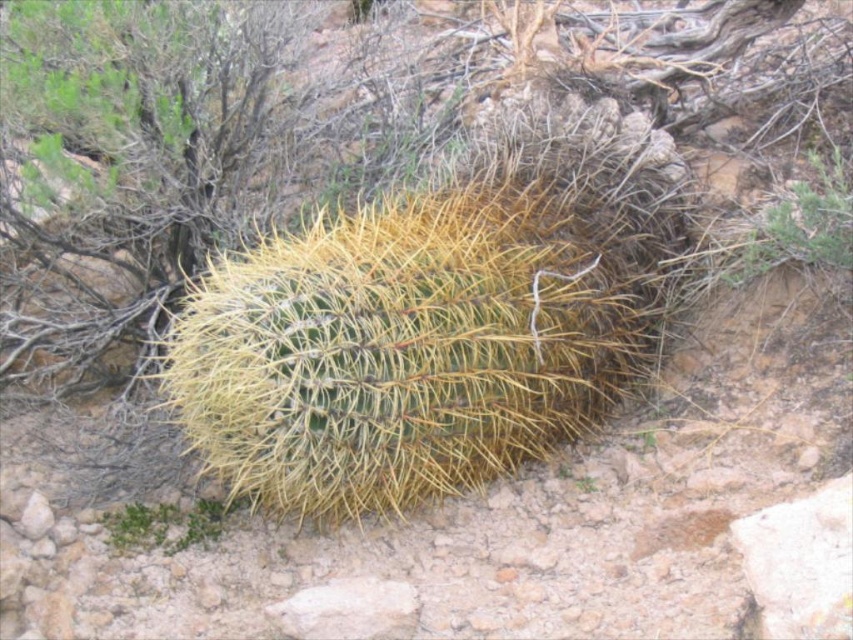
Question: Which of the following is the farthest from the observer?

Choices:
 (A) green spiky cactus at lower left
 (B) green spiky cactus at upper right

Answer: (A)

Question: Does green spiky cactus at upper right have a smaller size compared to green spiky cactus at lower left?

Choices:
 (A) yes
 (B) no

Answer: (B)

Question: Is green spiky cactus at upper right smaller than green spiky cactus at lower left?

Choices:
 (A) no
 (B) yes

Answer: (A)

Question: Is green spiky cactus at upper right closer to the viewer compared to green spiky cactus at lower left?

Choices:
 (A) no
 (B) yes

Answer: (B)

Question: Which object appears closest to the camera in this image?

Choices:
 (A) green spiky cactus at lower left
 (B) green spiky cactus at upper right

Answer: (B)

Question: Which point appears closest to the camera in this image?

Choices:
 (A) (117, 516)
 (B) (805, 160)

Answer: (A)